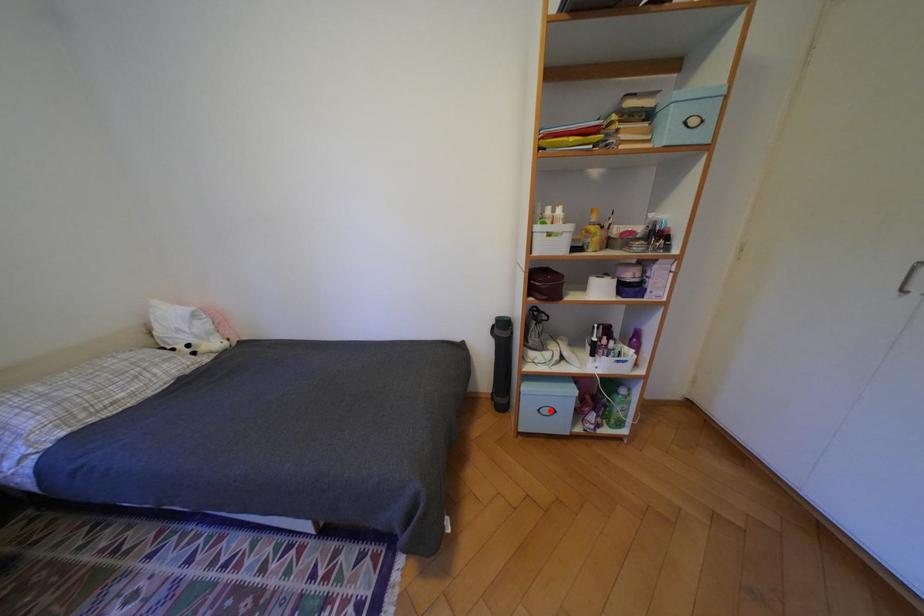
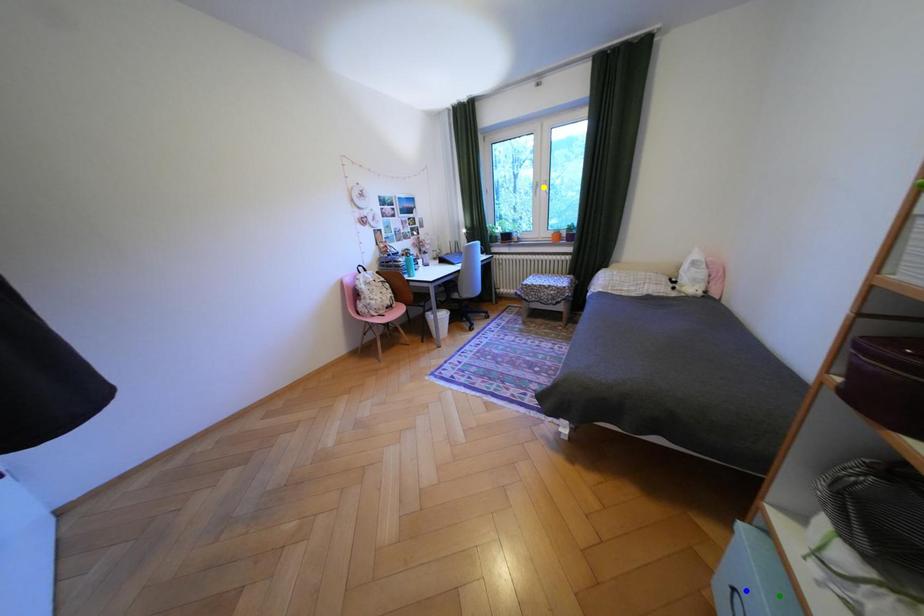
Question: I am providing you with two images of the same scene from different viewpoints. A red point is marked on the first image. You are given multiple points on the second image. Which point in image 2 is actually the same real-world point as the red point in image 1?

Choices:
 (A) blue point
 (B) green point
 (C) yellow point

Answer: (A)